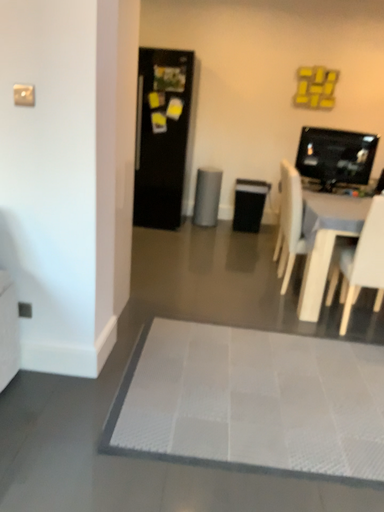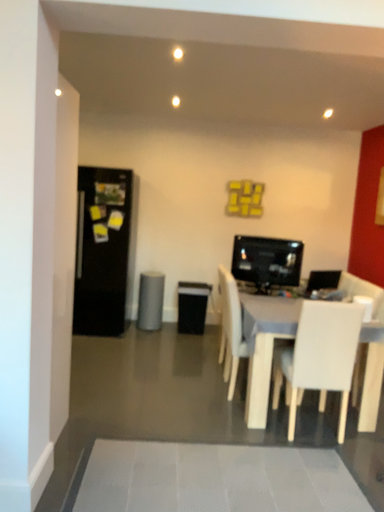
Question: Which way did the camera rotate in the video?

Choices:
 (A) rotated right
 (B) rotated left

Answer: (A)